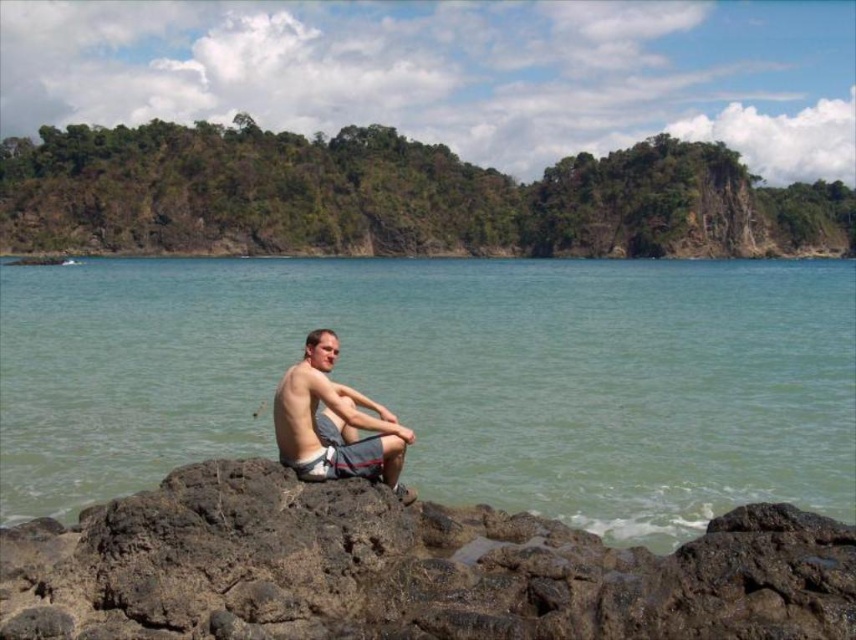
From the picture: Based on the scene description, what can be found at the coordinates point [449,378]?

At point [449,378] lies clear water at center.

You are a photographer trying to capture the perfect shot of the brown rough rock at lower center and the matte gray shorts at center. To ensure both subjects are in frame, you need to know their relative positions. Which object is positioned to the right of the other?

The brown rough rock at lower center is to the right of the matte gray shorts at center.